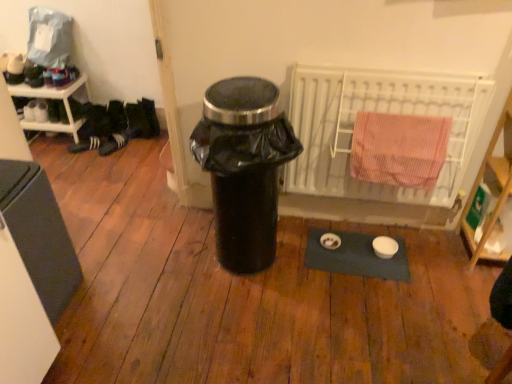
Locate an element on the screen. This screenshot has height=384, width=512. free location in front of black matte shoe at left, which appears as the 1th shoe when viewed from the left is located at coordinates (72, 156).